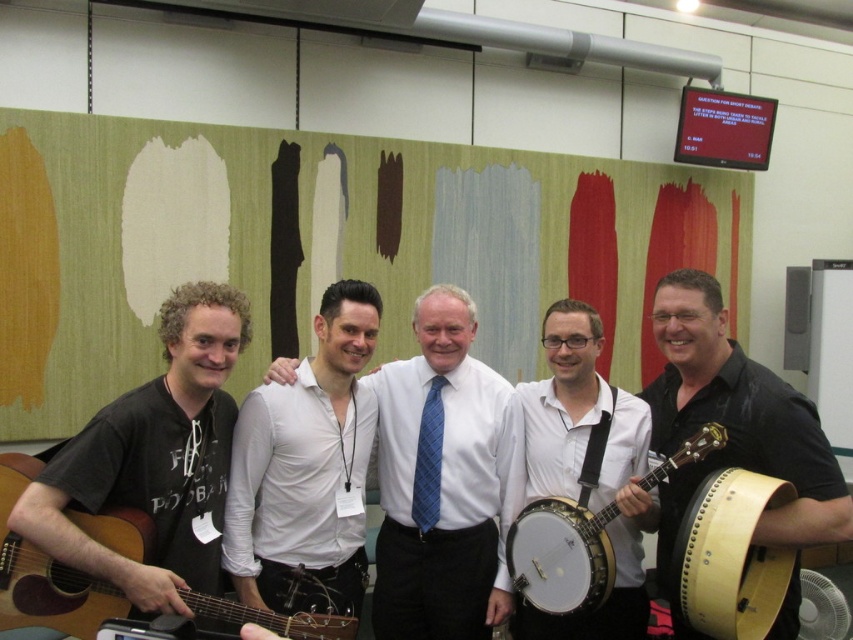
How far apart are white smooth shirt at center and wooden acoustic guitar at left?

white smooth shirt at center is 16.36 inches away from wooden acoustic guitar at left.

Can you confirm if white smooth shirt at center is taller than wooden acoustic guitar at left?

Indeed, white smooth shirt at center has a greater height compared to wooden acoustic guitar at left.

The image size is (853, 640). Identify the location of white smooth shirt at center. (306, 468).

The image size is (853, 640). I want to click on white smooth shirt at center, so click(306, 468).

Is black leather banjo at center thinner than blue plaid tie at center?

No.

Can you confirm if black leather banjo at center is positioned below blue plaid tie at center?

Actually, black leather banjo at center is above blue plaid tie at center.

Is point (666, 420) farther from viewer compared to point (422, 433)?

No, it is not.

This screenshot has width=853, height=640. I want to click on black leather banjo at center, so point(730,429).

Does point (160, 330) come behind point (593, 532)?

No, it is in front of (593, 532).

This screenshot has height=640, width=853. I want to click on dark gray t-shirt at left, so click(154, 458).

Find the location of a particular element. dark gray t-shirt at left is located at coordinates click(154, 458).